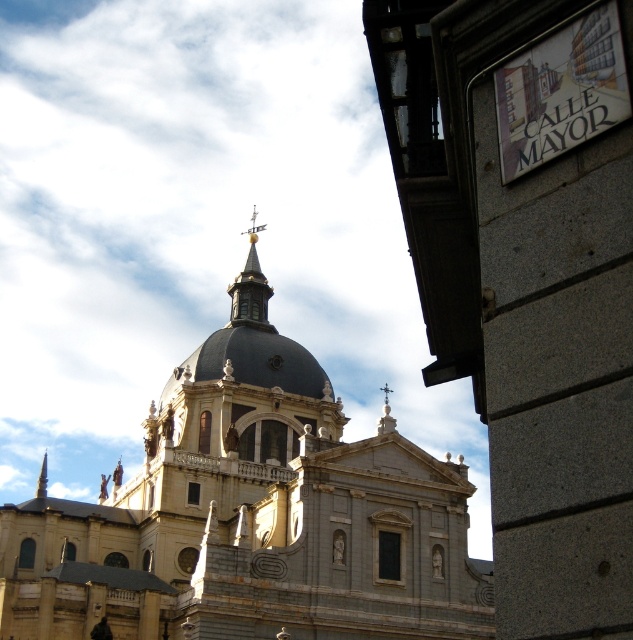
Question: Is gray stone church at center wider than gold-bronze spire at upper center?

Choices:
 (A) yes
 (B) no

Answer: (A)

Question: Which point is farther to the camera?

Choices:
 (A) gray stone church at center
 (B) gold-bronze spire at upper center

Answer: (B)

Question: Can you confirm if gray stone church at center is positioned to the right of gold-bronze spire at upper center?

Choices:
 (A) yes
 (B) no

Answer: (B)

Question: Which object is closer to the camera taking this photo?

Choices:
 (A) gray stone church at center
 (B) gold-bronze spire at upper center

Answer: (A)

Question: Can you confirm if gray stone church at center is positioned below gold-bronze spire at upper center?

Choices:
 (A) yes
 (B) no

Answer: (A)

Question: Which object is closer to the camera taking this photo?

Choices:
 (A) gold-bronze spire at upper center
 (B) gray stone church at center

Answer: (B)